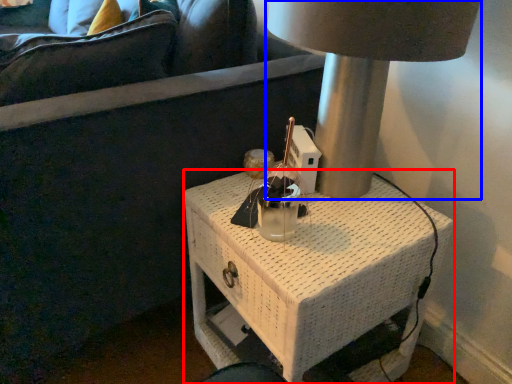
Question: Which object appears closest to the camera in this image, nightstand (highlighted by a red box) or lamp (highlighted by a blue box)?

Choices:
 (A) nightstand
 (B) lamp

Answer: (B)